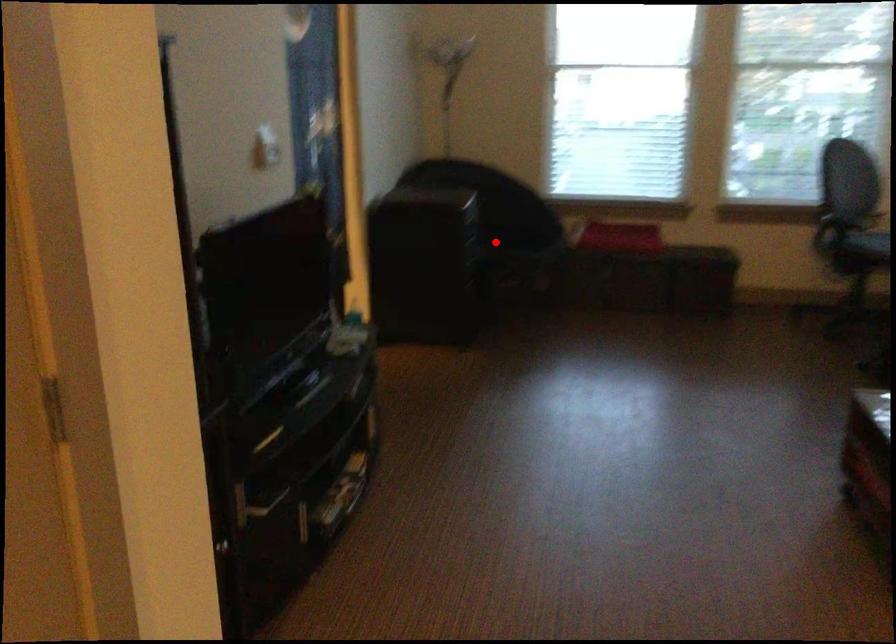
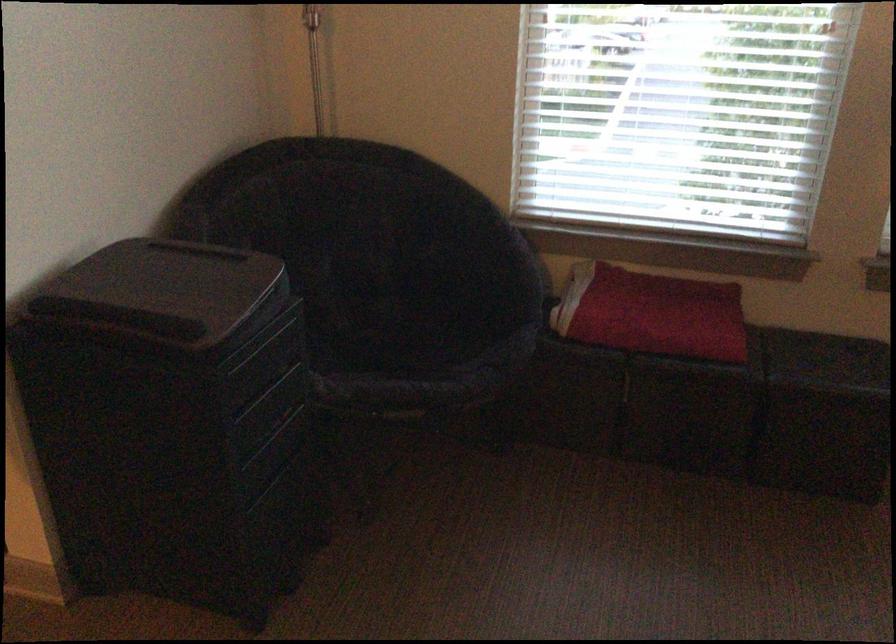
Question: A red point is marked in image1. In image2, is the corresponding 3D point closer to the camera or farther? Reply with the corresponding letter.

Choices:
 (A) The corresponding 3D point is closer.
 (B) The corresponding 3D point is farther.

Answer: (A)